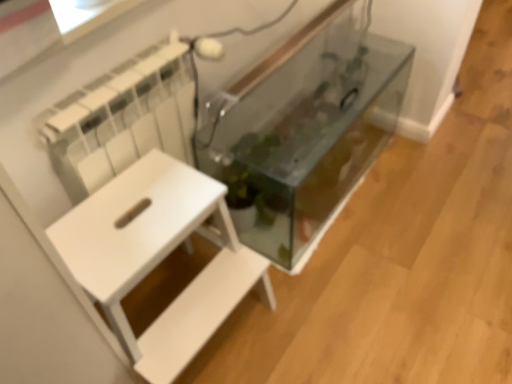
The height and width of the screenshot is (384, 512). What are the coordinates of `white matte side table at left` in the screenshot? It's located at (158, 258).

The height and width of the screenshot is (384, 512). What do you see at coordinates (158, 258) in the screenshot? I see `white matte side table at left` at bounding box center [158, 258].

In order to face white matte side table at left, should I rotate leftwards or rightwards?

To align with it, rotate left about 11.060°.

Describe the element at coordinates (304, 130) in the screenshot. I see `transparent glass tank at center` at that location.

At what (x,y) coordinates should I click in order to perform the action: click on transparent glass tank at center. Please return your answer as a coordinate pair (x, y). This screenshot has height=384, width=512. Looking at the image, I should click on (304, 130).

This screenshot has height=384, width=512. Find the location of `white matte side table at left`. white matte side table at left is located at coordinates [158, 258].

Which is more to the right, transparent glass tank at center or white matte side table at left?

transparent glass tank at center.

Between transparent glass tank at center and white matte side table at left, which one is positioned in front?

white matte side table at left is in front.

Does point (276, 190) appear closer or farther from the camera than point (162, 367)?

Point (276, 190) is farther from the camera than point (162, 367).

From the image's perspective, is transparent glass tank at center above or below white matte side table at left?

From the image's perspective, transparent glass tank at center appears above white matte side table at left.

From a real-world perspective, is transparent glass tank at center positioned above or below white matte side table at left?

transparent glass tank at center is situated lower than white matte side table at left in the real world.

Does transparent glass tank at center have a greater width compared to white matte side table at left?

Incorrect, the width of transparent glass tank at center does not surpass that of white matte side table at left.

Does transparent glass tank at center have a lesser height compared to white matte side table at left?

Indeed, transparent glass tank at center has a lesser height compared to white matte side table at left.

Which of these two, transparent glass tank at center or white matte side table at left, is bigger?

Bigger between the two is transparent glass tank at center.

Would you say white matte side table at left is part of transparent glass tank at center's contents?

No, white matte side table at left is not a part of transparent glass tank at center.

Are transparent glass tank at center and white matte side table at left located far from each other?

Actually, transparent glass tank at center and white matte side table at left are a little close together.

Could you tell me if transparent glass tank at center is turned towards white matte side table at left?

No, transparent glass tank at center does not turn towards white matte side table at left.

Measure the distance between transparent glass tank at center and white matte side table at left.

18.74 inches.

Locate an element on the screen. This screenshot has height=384, width=512. furniture on the left of the transparent glass tank at center is located at coordinates (158, 258).

Which object is positioned more to the left, white matte side table at left or transparent glass tank at center?

white matte side table at left is more to the left.

In the image, is white matte side table at left positioned in front of or behind transparent glass tank at center?

Visually, white matte side table at left is located in front of transparent glass tank at center.

Is point (178, 313) farther from camera compared to point (282, 68)?

No, (178, 313) is in front of (282, 68).

From the image's perspective, between white matte side table at left and transparent glass tank at center, which one is located above?

transparent glass tank at center appears higher in the image.

From a real-world perspective, is white matte side table at left over transparent glass tank at center?

Yes, from a real-world perspective, white matte side table at left is above transparent glass tank at center.

In the scene shown: Considering the relative sizes of white matte side table at left and transparent glass tank at center in the image provided, is white matte side table at left thinner than transparent glass tank at center?

Incorrect, the width of white matte side table at left is not less than that of transparent glass tank at center.

Between white matte side table at left and transparent glass tank at center, which one has more height?

With more height is white matte side table at left.

In terms of size, does white matte side table at left appear bigger or smaller than transparent glass tank at center?

Considering their sizes, white matte side table at left takes up less space than transparent glass tank at center.

Is white matte side table at left not within transparent glass tank at center?

That's correct, white matte side table at left is outside of transparent glass tank at center.

Is the surface of white matte side table at left in direct contact with transparent glass tank at center?

white matte side table at left and transparent glass tank at center are not in contact.

Could you tell me if white matte side table at left is facing transparent glass tank at center?

No, white matte side table at left is not oriented towards transparent glass tank at center.

Can you tell me how much white matte side table at left and transparent glass tank at center differ in facing direction?

1.16 degrees.

The width and height of the screenshot is (512, 384). I want to click on furniture that appears in front of the transparent glass tank at center, so click(158, 258).

Locate an element on the screen. The image size is (512, 384). furniture that appears in front of the transparent glass tank at center is located at coordinates (158, 258).

The width and height of the screenshot is (512, 384). Identify the location of glass box on the right of white matte side table at left. (304, 130).